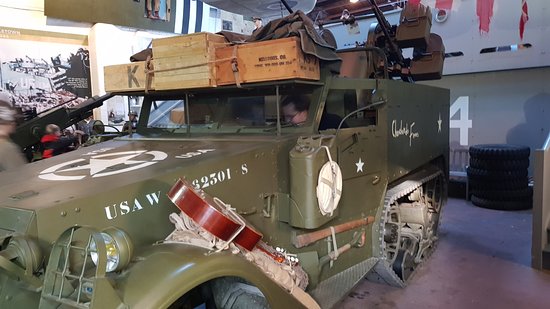
The width and height of the screenshot is (550, 309). Find the location of `wall`. wall is located at coordinates (519, 111).